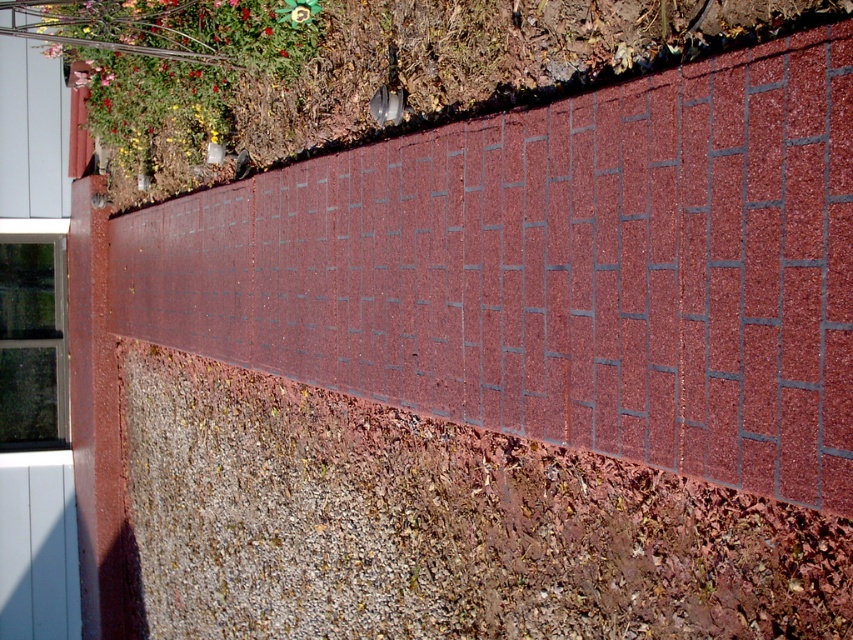
Question: Is brick at center to the left of green leafy plant at upper left from the viewer's perspective?

Choices:
 (A) no
 (B) yes

Answer: (A)

Question: Which point is farther to the camera?

Choices:
 (A) green leafy plant at upper left
 (B) brick at center

Answer: (A)

Question: Is brick at center in front of green leafy plant at upper left?

Choices:
 (A) yes
 (B) no

Answer: (A)

Question: Which of the following is the closest to the observer?

Choices:
 (A) (820, 392)
 (B) (271, 38)

Answer: (A)

Question: Does brick at center have a larger size compared to green leafy plant at upper left?

Choices:
 (A) yes
 (B) no

Answer: (B)

Question: Which point is farther to the camera?

Choices:
 (A) green leafy plant at upper left
 (B) brick at center

Answer: (A)